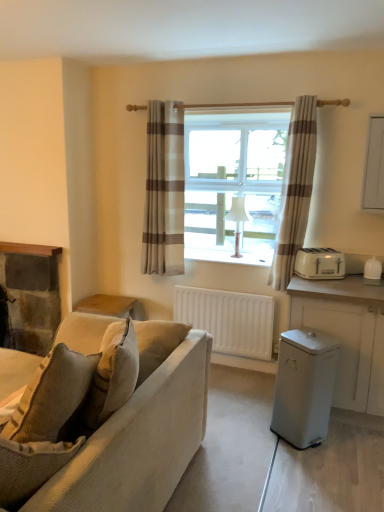
Question: Does white matte radiator at center have a lesser width compared to white matte cabinet at right?

Choices:
 (A) yes
 (B) no

Answer: (A)

Question: From a real-world perspective, is white matte radiator at center beneath white matte cabinet at right?

Choices:
 (A) yes
 (B) no

Answer: (A)

Question: Considering the relative sizes of white matte radiator at center and white matte cabinet at right in the image provided, is white matte radiator at center bigger than white matte cabinet at right?

Choices:
 (A) no
 (B) yes

Answer: (A)

Question: Is the position of white matte radiator at center more distant than that of white matte cabinet at right?

Choices:
 (A) no
 (B) yes

Answer: (B)

Question: Can you confirm if white matte radiator at center is wider than white matte cabinet at right?

Choices:
 (A) no
 (B) yes

Answer: (A)

Question: Does point (56, 292) appear closer or farther from the camera than point (344, 275)?

Choices:
 (A) farther
 (B) closer

Answer: (A)

Question: Would you say dark stone fireplace at left is inside or outside white plastic toaster at right, placed as the 2th appliance when sorted from bottom to top?

Choices:
 (A) inside
 (B) outside

Answer: (B)

Question: From a real-world perspective, is dark stone fireplace at left physically located above or below white plastic toaster at right, positioned as the 1th appliance in top-to-bottom order?

Choices:
 (A) below
 (B) above

Answer: (A)

Question: Visually, is dark stone fireplace at left positioned to the left or to the right of white plastic toaster at right, the first appliance when ordered from back to front?

Choices:
 (A) left
 (B) right

Answer: (A)

Question: Does point (246, 307) appear closer or farther from the camera than point (309, 306)?

Choices:
 (A) farther
 (B) closer

Answer: (A)

Question: In terms of height, does white matte radiator at center look taller or shorter compared to white matte cabinet at right?

Choices:
 (A) tall
 (B) short

Answer: (B)

Question: Is white matte radiator at center bigger or smaller than white matte cabinet at right?

Choices:
 (A) big
 (B) small

Answer: (B)

Question: Considering the positions of white matte radiator at center and white matte cabinet at right in the image, is white matte radiator at center wider or thinner than white matte cabinet at right?

Choices:
 (A) wide
 (B) thin

Answer: (B)

Question: Considering the relative positions of beige striped curtain at center, the second curtain positioned from the right, and white matte radiator at center in the image provided, is beige striped curtain at center, the second curtain positioned from the right, to the left or to the right of white matte radiator at center?

Choices:
 (A) left
 (B) right

Answer: (A)

Question: Is beige striped curtain at center, arranged as the first curtain when viewed from the left, taller or shorter than white matte radiator at center?

Choices:
 (A) short
 (B) tall

Answer: (B)